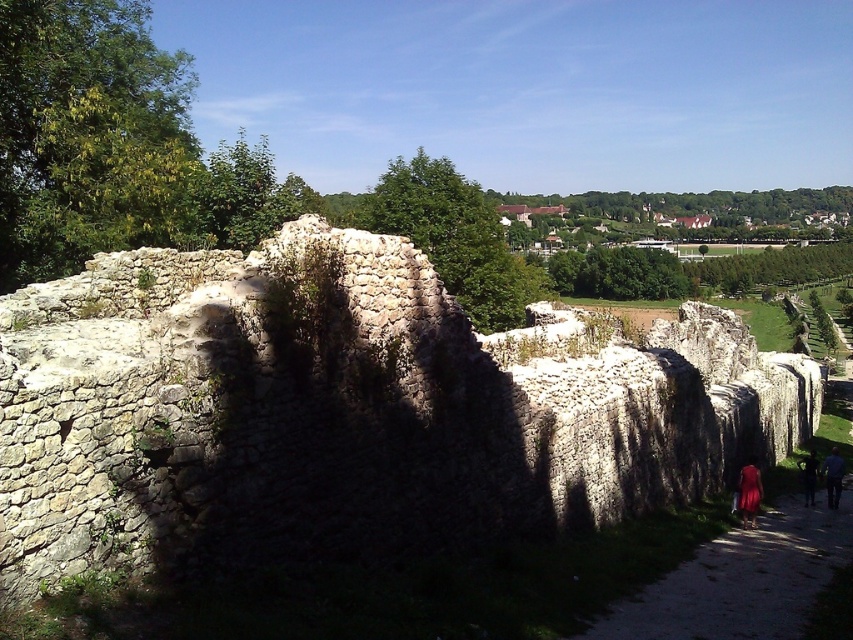
Question: Is dirt path at lower right wider than dark blue jeans at lower right?

Choices:
 (A) yes
 (B) no

Answer: (A)

Question: Is dirt path at lower right to the right of blue denim jeans at lower right from the viewer's perspective?

Choices:
 (A) yes
 (B) no

Answer: (B)

Question: Considering the real-world distances, which object is closest to the blue denim jeans at lower right?

Choices:
 (A) dirt path at lower right
 (B) dark blue jeans at lower right

Answer: (B)

Question: Among these points, which one is nearest to the camera?

Choices:
 (A) (828, 461)
 (B) (752, 518)
 (C) (738, 618)
 (D) (804, 490)

Answer: (C)

Question: Does dirt path at lower right appear on the left side of blue denim jeans at lower right?

Choices:
 (A) yes
 (B) no

Answer: (A)

Question: Which point is farther from the camera taking this photo?

Choices:
 (A) (753, 476)
 (B) (815, 481)
 (C) (746, 554)

Answer: (B)